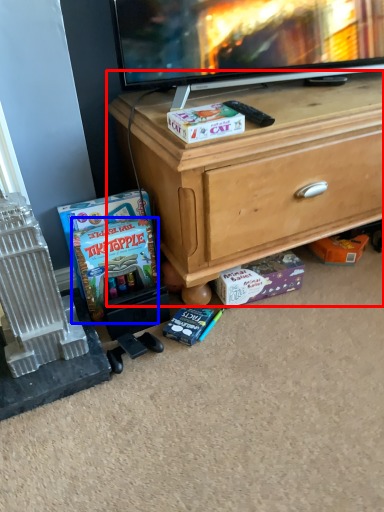
Question: Which object is further to the camera taking this photo, desk (highlighted by a red box) or comic book (highlighted by a blue box)?

Choices:
 (A) desk
 (B) comic book

Answer: (B)